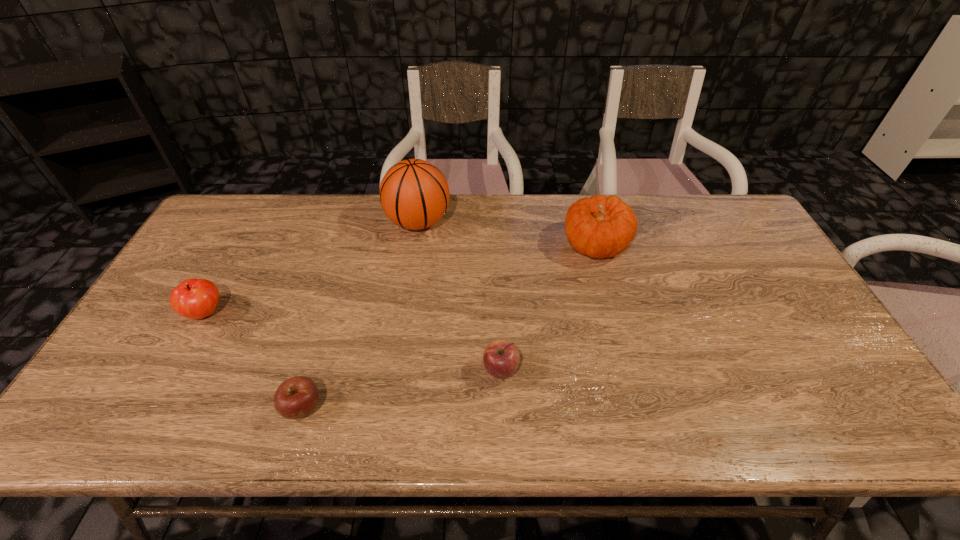
You are a GUI agent. You are given a task and a screenshot of the screen. Output one action in this format:
    pyautogui.click(x=<x>, y=<y>)
    Task: Click on the basketball
    This screenshot has height=540, width=960.
    Given the screenshot: What is the action you would take?
    pyautogui.click(x=414, y=194)

The height and width of the screenshot is (540, 960). What are the coordinates of `the third object from right to left` in the screenshot? It's located at (414, 194).

You are a GUI agent. You are given a task and a screenshot of the screen. Output one action in this format:
    pyautogui.click(x=<x>, y=<y>)
    Task: Click on the rightmost object
    
    Given the screenshot: What is the action you would take?
    pyautogui.click(x=600, y=227)

Locate an element on the screen. Image resolution: width=960 pixels, height=540 pixels. the second tallest object is located at coordinates (600, 227).

The width and height of the screenshot is (960, 540). Identify the location of the third farthest object. (193, 298).

Identify the location of the leftmost apple. (193, 298).

Identify the location of the second farthest apple. (501, 358).

Where is `the fourth farthest object`? The height and width of the screenshot is (540, 960). the fourth farthest object is located at coordinates (501, 358).

This screenshot has width=960, height=540. I want to click on the second apple from right to left, so click(297, 397).

You are a GUI agent. You are given a task and a screenshot of the screen. Output one action in this format:
    pyautogui.click(x=<x>, y=<y>)
    Task: Click on the second object from left to right
    Image resolution: width=960 pixels, height=540 pixels.
    Given the screenshot: What is the action you would take?
    (x=297, y=397)